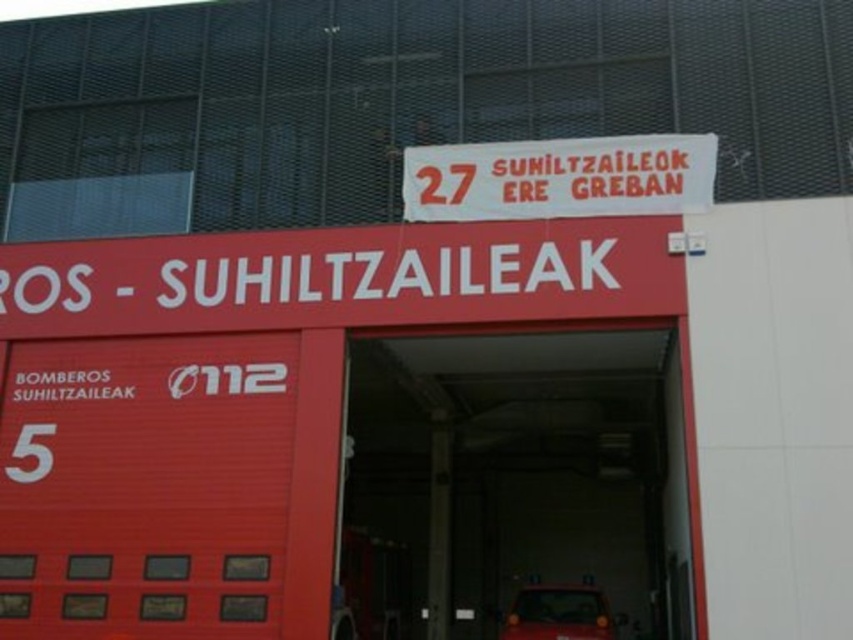
You are a visitor arriving at the fire station and need to read the emergency contact information displayed on the white paper sign at center and the metallic red car at center. Which one has a larger width?

The white paper sign at center has a larger width than the metallic red car at center.